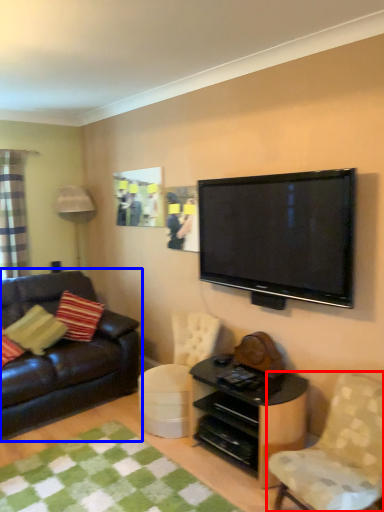
Question: Which object appears farthest to the camera in this image, chair (highlighted by a red box) or studio couch (highlighted by a blue box)?

Choices:
 (A) chair
 (B) studio couch

Answer: (B)